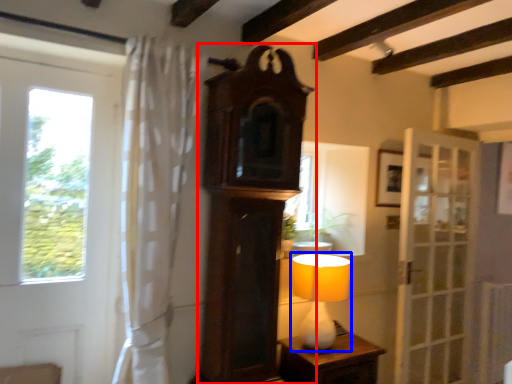
Question: Which of the following is the closest to the observer, clock (highlighted by a red box) or table lamp (highlighted by a blue box)?

Choices:
 (A) clock
 (B) table lamp

Answer: (A)